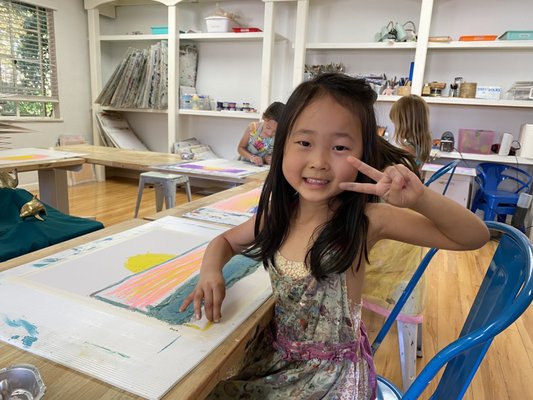
Identify the location of stool. The image size is (533, 400). (167, 185).